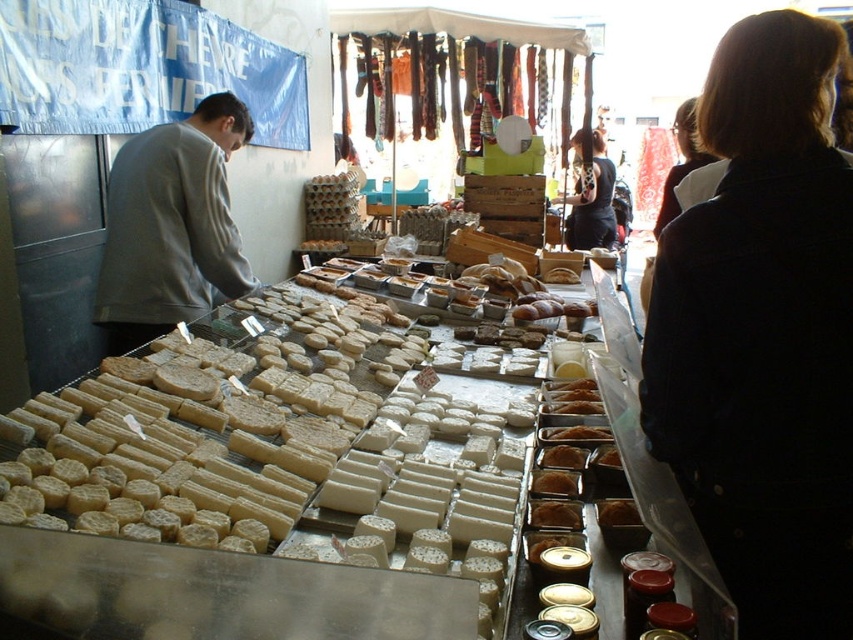
You are a customer at the cheese stall and want to buy both the dark brown hair at upper right and the matte brown cheese at center. However, your bag can only hold one item. Based on their sizes, which item should you choose to fit in your bag?

The matte brown cheese at center is smaller in size compared to the dark brown hair at upper right, so you should choose the matte brown cheese at center to fit in your bag.

What are the coordinates of the gray matte sweatshirt at left?

The gray matte sweatshirt at left is located at coordinates point (171, 225).